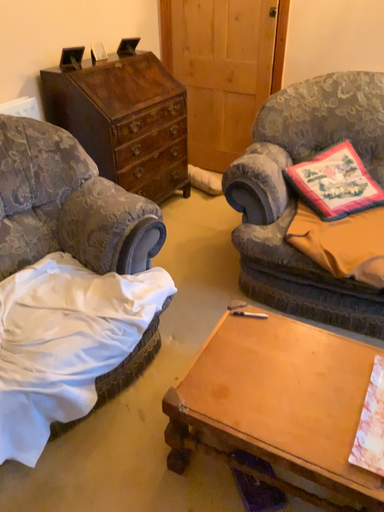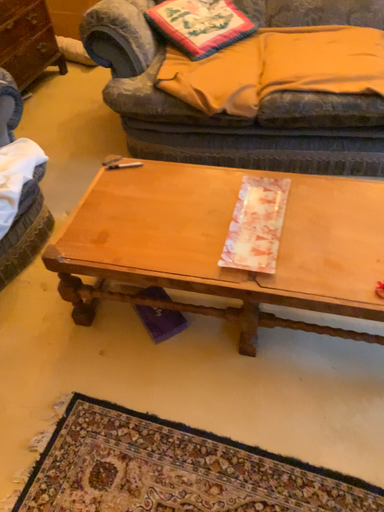
Question: How did the camera likely rotate when shooting the video?

Choices:
 (A) rotated upward
 (B) rotated downward

Answer: (B)